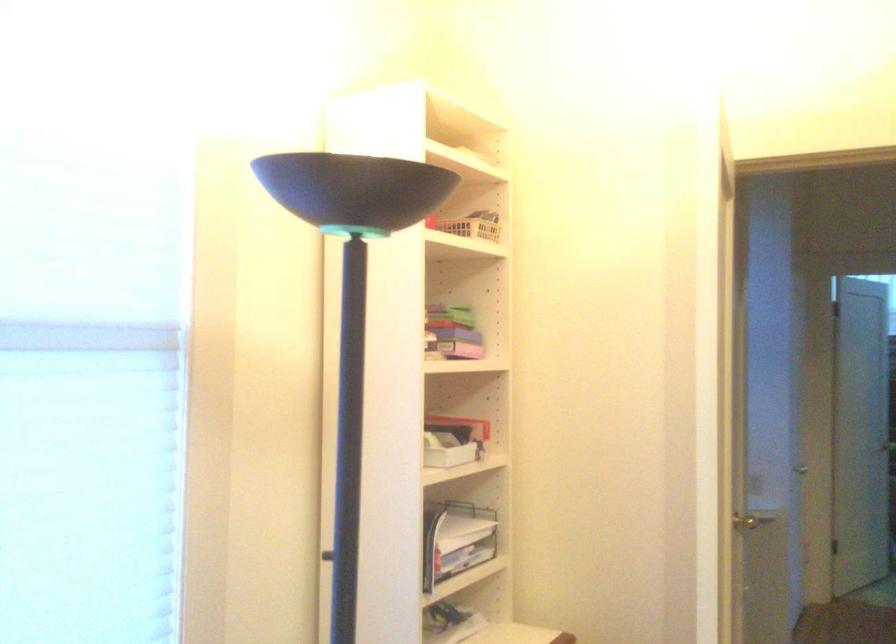
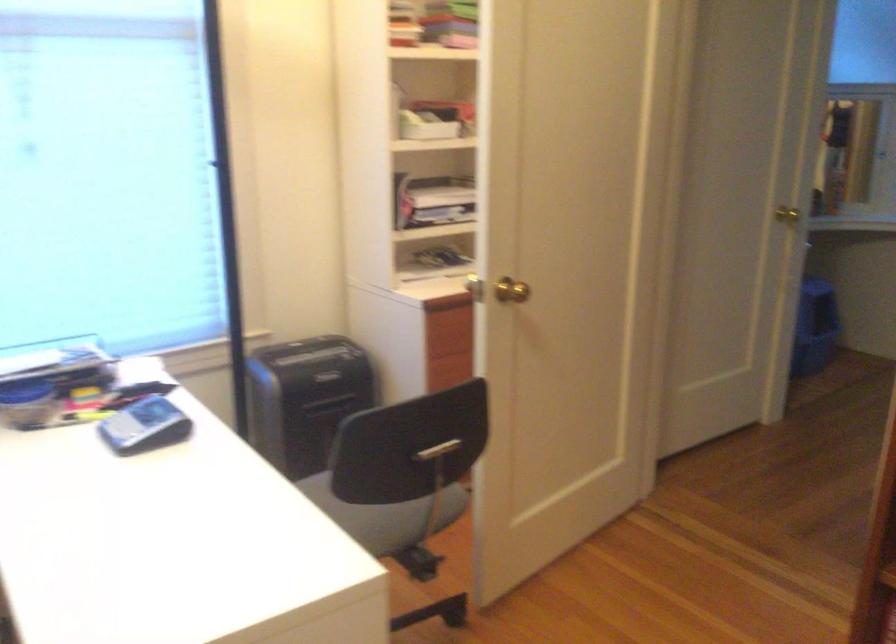
Question: Which direction would the cameraman need to move to produce the second image? Reply with the corresponding letter.

Choices:
 (A) Left
 (B) Right
 (C) Forward
 (D) Backward

Answer: (B)